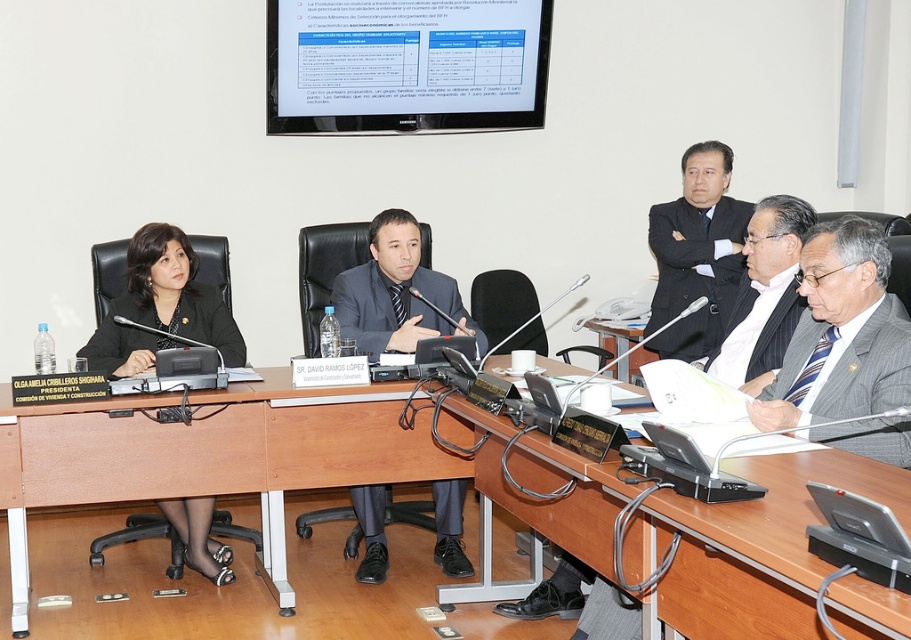
Question: Which point is farther from the camera taking this photo?

Choices:
 (A) (892, 301)
 (B) (160, 324)
 (C) (366, 20)
 (D) (746, 326)

Answer: (C)

Question: Is striped wool suit at right further to the viewer compared to dark gray suit at center?

Choices:
 (A) yes
 (B) no

Answer: (B)

Question: Does white glossy screen at upper center have a greater width compared to matte black suit at left?

Choices:
 (A) no
 (B) yes

Answer: (B)

Question: Which point is closer to the camera?

Choices:
 (A) (684, 248)
 (B) (354, 490)
 (C) (646, 353)

Answer: (B)

Question: Can you confirm if dark gray suit at upper right is bigger than dark gray suit at center?

Choices:
 (A) yes
 (B) no

Answer: (A)

Question: Estimate the real-world distances between objects in this image. Which object is farther from the white glossy screen at upper center?

Choices:
 (A) dark gray pinstripe suit at right
 (B) brown wood table at center
 (C) matte black suit at left
 (D) dark gray suit at upper right

Answer: (A)